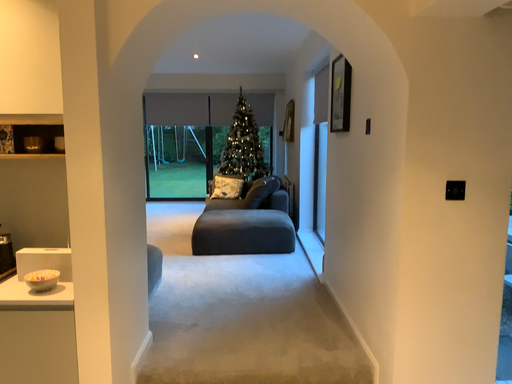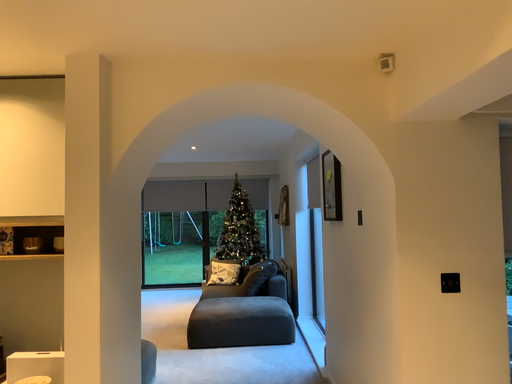
Question: How did the camera likely rotate when shooting the video?

Choices:
 (A) rotated upward
 (B) rotated downward

Answer: (A)